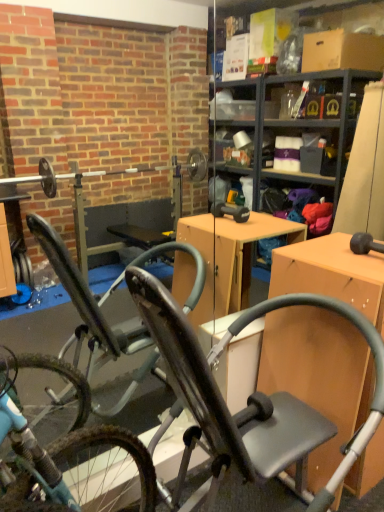
Locate an element on the screen. matte wood desk at right is located at coordinates (319, 375).

What do you see at coordinates (319, 375) in the screenshot? The image size is (384, 512). I see `matte wood desk at right` at bounding box center [319, 375].

Describe the element at coordinates (255, 394) in the screenshot. The width and height of the screenshot is (384, 512). I see `metallic gray exercise bike at center` at that location.

Find the location of `metallic gray exercise bike at center`. metallic gray exercise bike at center is located at coordinates (255, 394).

In order to face metallic gray exercise bike at center, should I rotate leftwards or rightwards?

Rotate right and turn 2.087 degrees.

What is the approximate width of metallic gray exercise bike at center?

27.38 inches.

Where is `matte wood desk at right`? matte wood desk at right is located at coordinates (319, 375).

Which is more to the right, metallic gray exercise bike at center or matte wood desk at right?

matte wood desk at right.

Which object is further away from the camera, metallic gray exercise bike at center or matte wood desk at right?

matte wood desk at right is further from the camera.

Considering the points (360, 445) and (302, 246), which point is in front, point (360, 445) or point (302, 246)?

The point (360, 445) is closer to the camera.

From the image's perspective, is metallic gray exercise bike at center on matte wood desk at right?

No, from the image's perspective, metallic gray exercise bike at center is not above matte wood desk at right.

From a real-world perspective, is metallic gray exercise bike at center physically located above or below matte wood desk at right?

metallic gray exercise bike at center is situated higher than matte wood desk at right in the real world.

Which of these two, metallic gray exercise bike at center or matte wood desk at right, is wider?

metallic gray exercise bike at center is wider.

Does metallic gray exercise bike at center have a greater height compared to matte wood desk at right?

Yes, metallic gray exercise bike at center is taller than matte wood desk at right.

Can you confirm if metallic gray exercise bike at center is smaller than matte wood desk at right?

Actually, metallic gray exercise bike at center might be larger than matte wood desk at right.

Do you think metallic gray exercise bike at center is within matte wood desk at right, or outside of it?

metallic gray exercise bike at center is located beyond the bounds of matte wood desk at right.

Is metallic gray exercise bike at center beside matte wood desk at right?

metallic gray exercise bike at center and matte wood desk at right are clearly separated.

In the scene shown: Is metallic gray exercise bike at center oriented towards matte wood desk at right?

No, metallic gray exercise bike at center is not oriented towards matte wood desk at right.

How different are the orientations of metallic gray exercise bike at center and matte wood desk at right in degrees?

The angle between the facing direction of metallic gray exercise bike at center and the facing direction of matte wood desk at right is 0.926 degrees.

Measure the distance from metallic gray exercise bike at center to matte wood desk at right.

metallic gray exercise bike at center and matte wood desk at right are 9.26 inches apart.

Find the location of a particular element. desk below the metallic gray exercise bike at center (from a real-world perspective) is located at coordinates (319, 375).

Can you confirm if matte wood desk at right is positioned to the right of metallic gray exercise bike at center?

Indeed, matte wood desk at right is positioned on the right side of metallic gray exercise bike at center.

Which is in front, matte wood desk at right or metallic gray exercise bike at center?

metallic gray exercise bike at center is closer to the camera.

Between point (338, 496) and point (354, 458), which one is positioned behind?

The point (338, 496) is behind.

From the image's perspective, relative to metallic gray exercise bike at center, is matte wood desk at right above or below?

From the image's perspective, matte wood desk at right appears above metallic gray exercise bike at center.

From a real-world perspective, which is physically below, matte wood desk at right or metallic gray exercise bike at center?

matte wood desk at right, from a real-world perspective.

Does matte wood desk at right have a lesser width compared to metallic gray exercise bike at center?

Yes.

Considering the sizes of matte wood desk at right and metallic gray exercise bike at center in the image, is matte wood desk at right taller or shorter than metallic gray exercise bike at center?

In the image, matte wood desk at right appears to be shorter than metallic gray exercise bike at center.

Based on their sizes in the image, would you say matte wood desk at right is bigger or smaller than metallic gray exercise bike at center?

Considering their sizes, matte wood desk at right takes up less space than metallic gray exercise bike at center.

Would you say matte wood desk at right is outside metallic gray exercise bike at center?

Yes, matte wood desk at right is not within metallic gray exercise bike at center.

Is matte wood desk at right beside metallic gray exercise bike at center?

No, matte wood desk at right is not next to metallic gray exercise bike at center.

Is metallic gray exercise bike at center at the back of matte wood desk at right?

No, matte wood desk at right is not facing the opposite direction of metallic gray exercise bike at center.

What's the angular difference between matte wood desk at right and metallic gray exercise bike at center's facing directions?

The angular difference between matte wood desk at right and metallic gray exercise bike at center is 0.926 degrees.

Find the location of `desk located behind the metallic gray exercise bike at center`. desk located behind the metallic gray exercise bike at center is located at coordinates (319, 375).

Identify the location of chair lying in front of the matte wood desk at right. This screenshot has width=384, height=512. click(x=255, y=394).

At what (x,y) coordinates should I click in order to perform the action: click on desk above the metallic gray exercise bike at center (from the image's perspective). Please return your answer as a coordinate pair (x, y). Looking at the image, I should click on (319, 375).